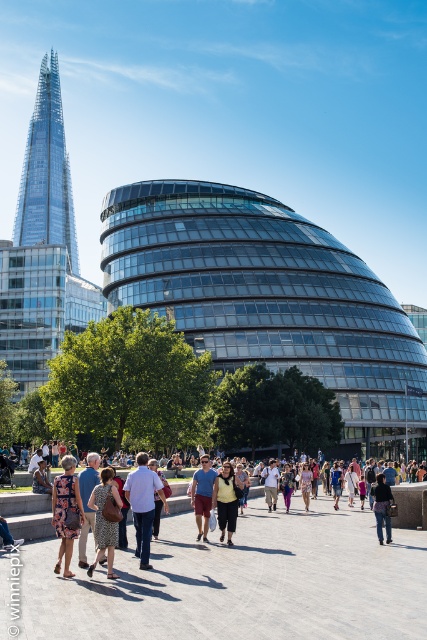
You are a photographer standing at the edge of the plaza, wanting to capture both the patterned fabric dress at center and the denim jacket at center in a single shot without moving your position. Given that your camera has a 50mm lens, which has a field of view that can capture about 45 degrees, can you fit both subjects into the frame?

The distance between the patterned fabric dress at center and the denim jacket at center is 10.19 meters. With a 50mm lens providing a 45 degree field of view, the maximum width you can capture at this distance would depend on your camera sensor size. Assuming a full frame sensor, the field of view at 50mm and 45 degrees would allow for a horizontal coverage of roughly 10 meters at 10 meters distance. Since the separation is 10.19 meters, it might be slightly too wide to fit both subjects comfortably in the

You are a photographer trying to capture both the patterned fabric dress at center and the matte blue shorts at center in a single shot. Which object should you focus on first to ensure both are in frame?

You should focus on the patterned fabric dress at center first since it is larger than the matte blue shorts at center, ensuring it fits within the frame while the smaller shorts will naturally be included.

You are a photographer standing in the plaza and want to take a photo of the transparent glass building at center without the matte black backpack at center blocking the view. Is the backpack in front of or behind the building?

The matte black backpack at center is behind the transparent glass building at center, so it won not block the view because the building is closer to you than the backpack.